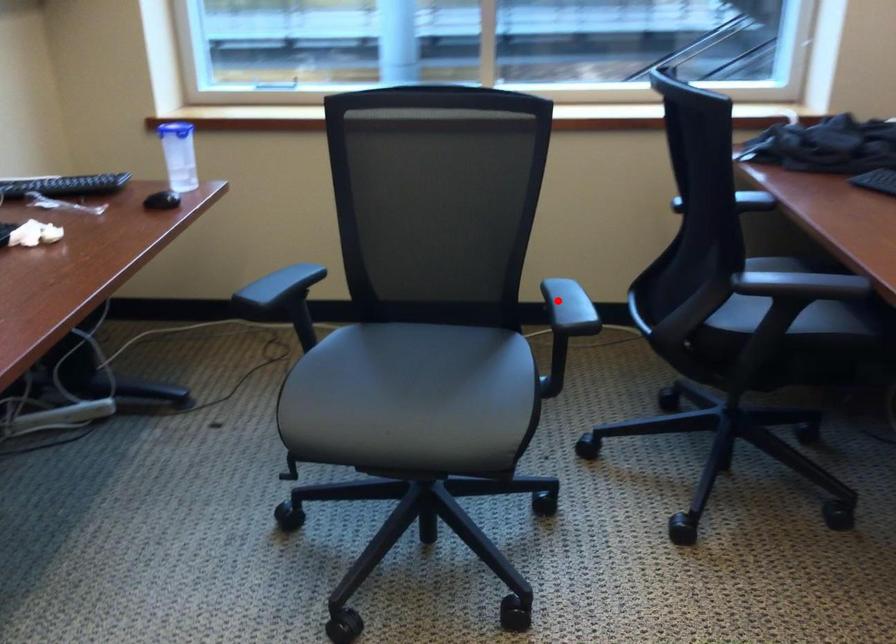
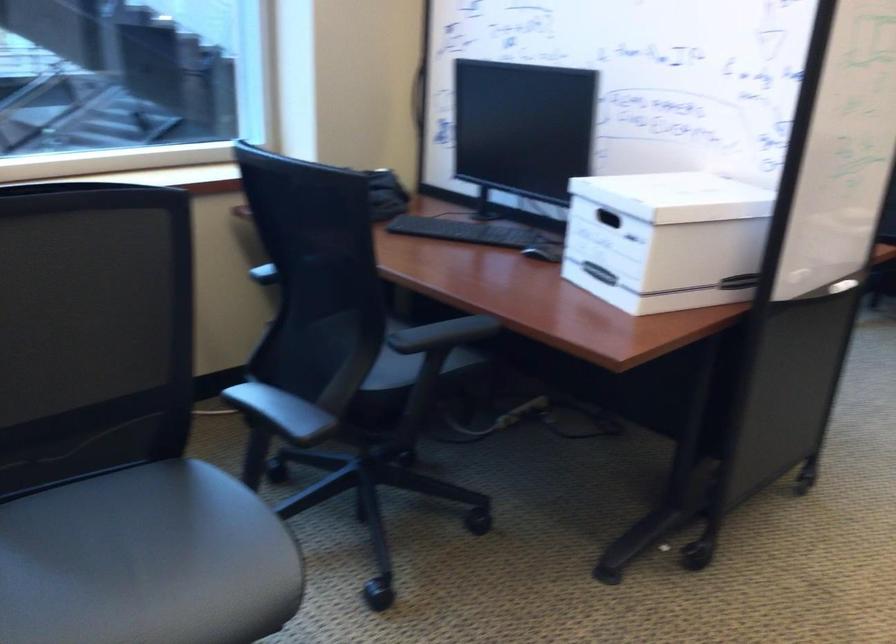
In the second image, find the point that corresponds to the highlighted location in the first image.

(280, 412)